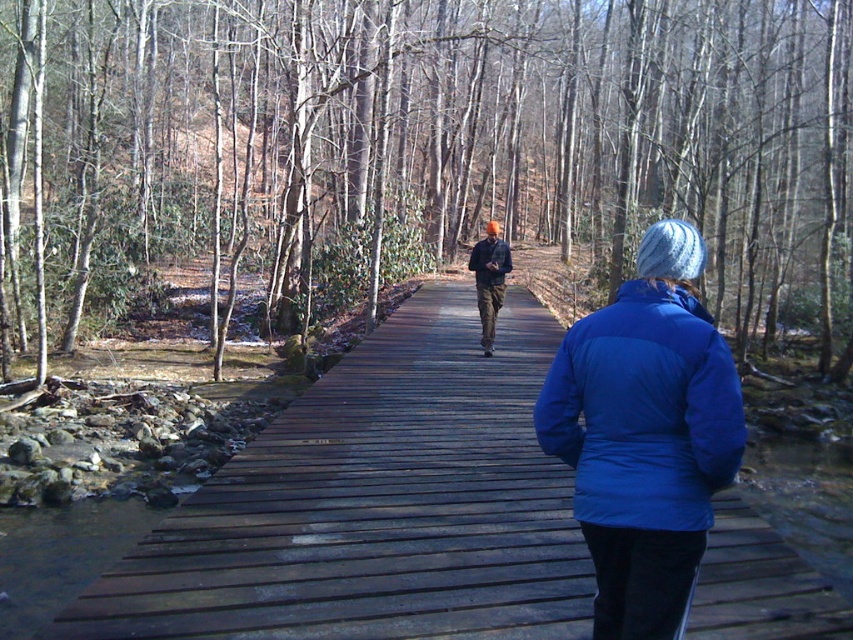
You are standing at the starting point of the boardwalk and want to reach the point marked at coordinates (570, 550). If your walking speed is 3 feet per second, how many seconds will it take you to reach that point?

The distance to the point is 13.60 feet. At a speed of 3 feet per second, dividing 13.60 by 3 gives approximately 4.53 seconds. So, it will take roughly 4.53 seconds to reach the point.

You are standing on the wooden boardwalk in the forest scene. You see the dark brown wooden bridge at center and the orange plaid shirt at center. Which object is positioned lower from your viewpoint?

The dark brown wooden bridge at center is located below the orange plaid shirt at center, so it is positioned lower from your viewpoint.

You are standing at the starting point of the boardwalk and want to reach the brown wood bridge at center. Based on the coordinates provided, in which direction should you walk to reach the bridge?

The brown wood bridge at center is located at coordinates point [419,152], so you should walk forward along the boardwalk towards the bridge.